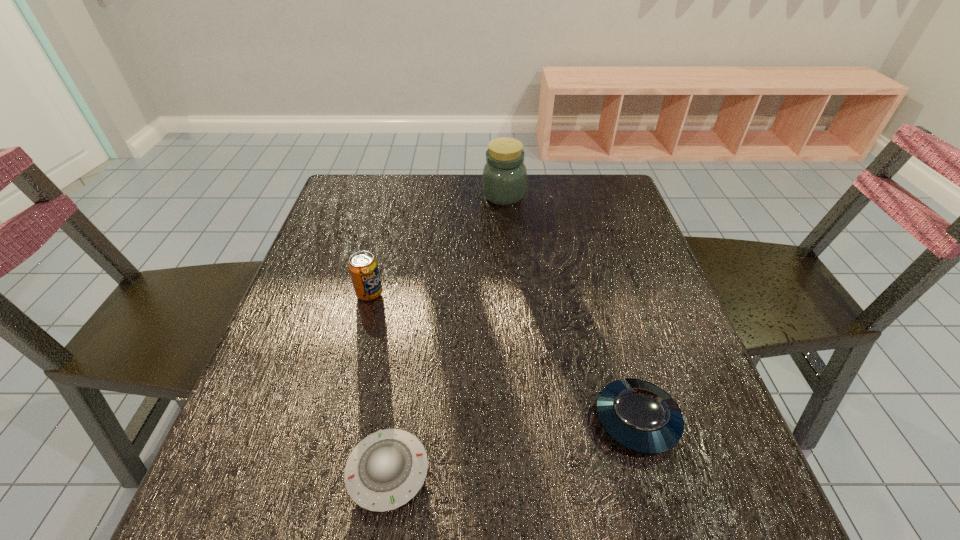
This screenshot has height=540, width=960. In order to click on jar in this screenshot , I will do `click(504, 179)`.

Locate an element on the screen. the farthest object is located at coordinates (504, 179).

Where is `soda can`? soda can is located at coordinates (363, 267).

Where is `the leftmost object`? The image size is (960, 540). the leftmost object is located at coordinates (363, 267).

Locate an element on the screen. The height and width of the screenshot is (540, 960). the third tallest object is located at coordinates (640, 416).

What are the coordinates of `the rightmost object` in the screenshot? It's located at (640, 416).

At what (x,y) coordinates should I click in order to perform the action: click on the left saucer. Please return your answer as a coordinate pair (x, y). Image resolution: width=960 pixels, height=540 pixels. Looking at the image, I should click on [386, 469].

What are the coordinates of `the second object from left to right` in the screenshot? It's located at (386, 469).

Where is `free spot located 0.070m on the front of the farthest object`? The image size is (960, 540). free spot located 0.070m on the front of the farthest object is located at coordinates (506, 222).

The width and height of the screenshot is (960, 540). In order to click on blank area located 0.300m on the back of the second farthest object in this screenshot , I will do `click(391, 211)`.